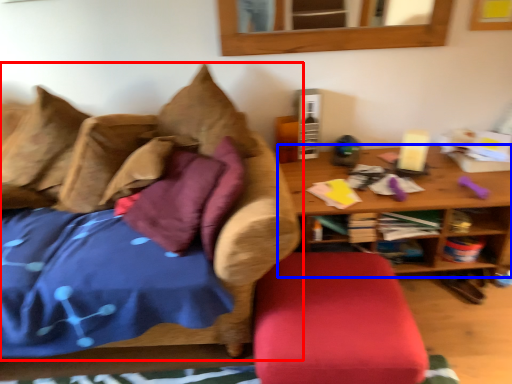
Question: Which point is further to the camera, studio couch (highlighted by a red box) or table (highlighted by a blue box)?

Choices:
 (A) studio couch
 (B) table

Answer: (B)